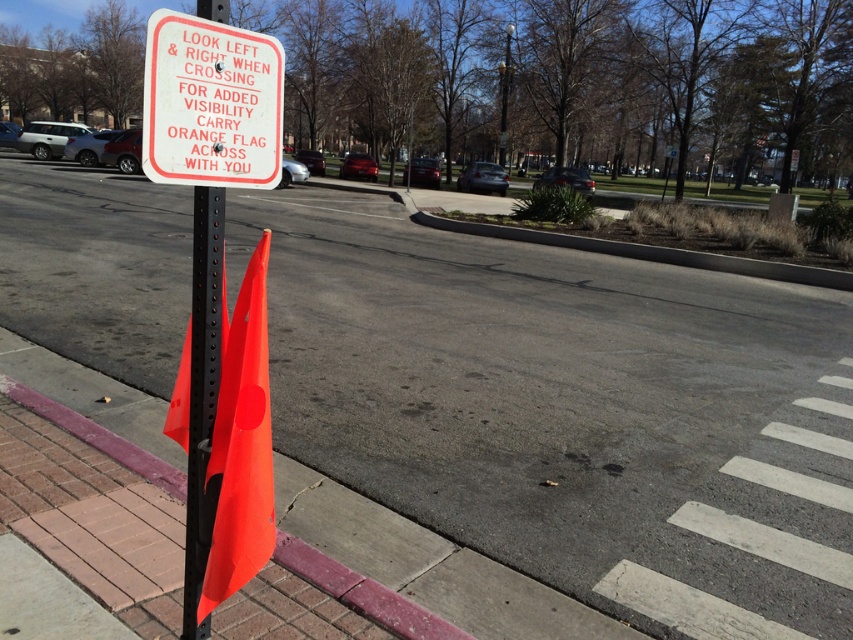
Question: Which of the following is the farthest from the observer?

Choices:
 (A) coord(196,365)
 (B) coord(213,33)
 (C) coord(100,444)

Answer: (C)

Question: Which point is closer to the camera taking this photo?

Choices:
 (A) (279, 547)
 (B) (256, 465)
 (C) (196, 76)

Answer: (C)

Question: Can you confirm if orange fabric traffic cone at left is smaller than brick at lower left?

Choices:
 (A) yes
 (B) no

Answer: (A)

Question: In this image, where is orange fabric traffic cone at left located relative to black textured pole at left?

Choices:
 (A) left
 (B) right

Answer: (B)

Question: Does orange fabric traffic cone at left appear on the right side of brick at lower left?

Choices:
 (A) yes
 (B) no

Answer: (A)

Question: Which point is closer to the camera taking this photo?

Choices:
 (A) (381, 598)
 (B) (204, 248)
 (C) (227, 342)

Answer: (B)